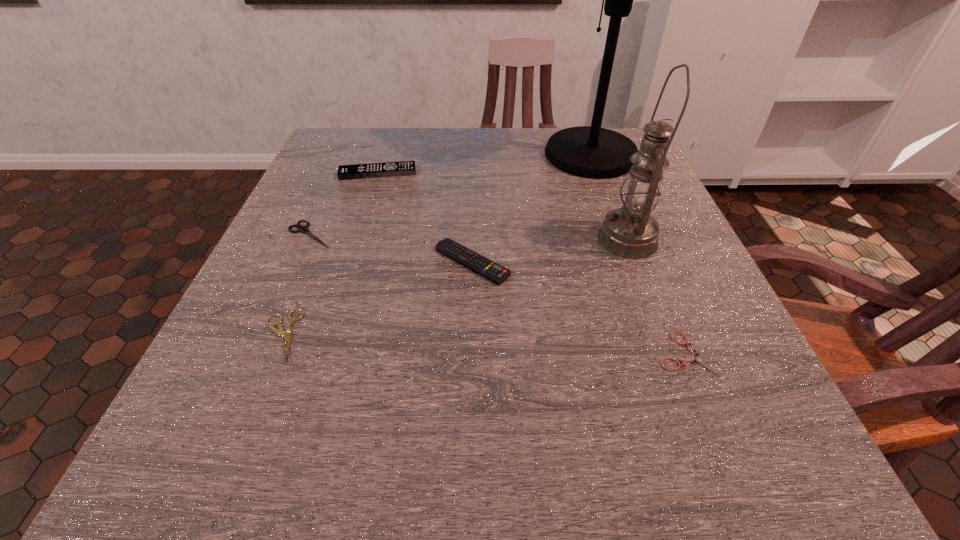
Find the location of a particular element. The height and width of the screenshot is (540, 960). the rightmost shears is located at coordinates (701, 360).

Image resolution: width=960 pixels, height=540 pixels. What are the coordinates of `vacant space located 0.150m on the left of the tallest object` in the screenshot? It's located at (481, 155).

In order to click on blank space located 0.090m on the left of the oil lamp in this screenshot , I will do tap(551, 239).

Identify the location of vacant space located on the front of the taller remote control. This screenshot has width=960, height=540. (356, 241).

Image resolution: width=960 pixels, height=540 pixels. In order to click on free region located 0.130m on the right of the right remote control in this screenshot , I will do `click(581, 262)`.

At what (x,y) coordinates should I click in order to perform the action: click on free space located 0.380m on the front of the fifth tallest object. Please return your answer as a coordinate pair (x, y). The width and height of the screenshot is (960, 540). Looking at the image, I should click on (219, 442).

Find the location of a particular element. The image size is (960, 540). free spot located 0.380m on the right of the second shortest shears is located at coordinates (545, 336).

The image size is (960, 540). What are the coordinates of `free space located 0.400m on the back of the shortest shears` in the screenshot? It's located at (620, 190).

Image resolution: width=960 pixels, height=540 pixels. What are the coordinates of `table lamp that is positioned at the far edge` in the screenshot? It's located at (593, 152).

In order to click on remote control at the far edge in this screenshot , I will do `click(404, 168)`.